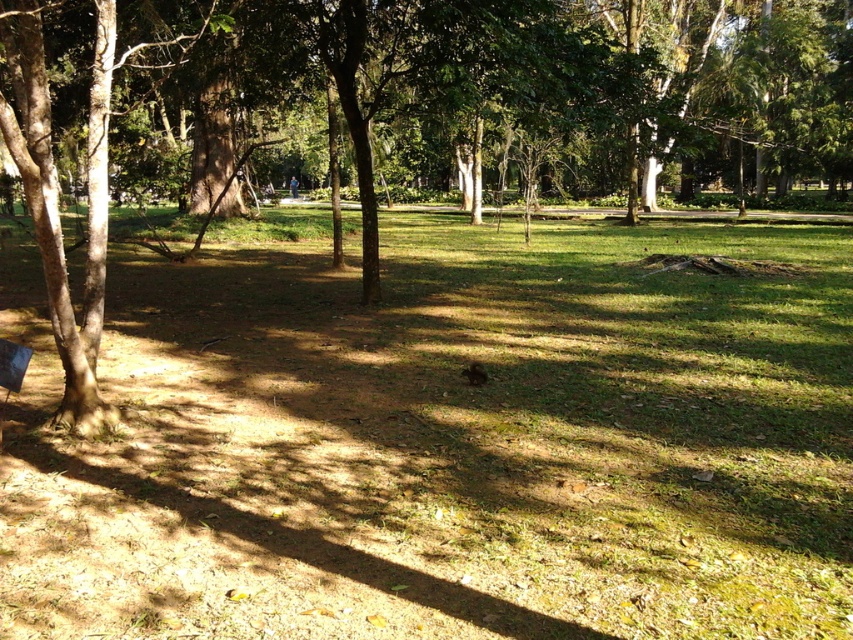
Where is `green grassy at center`? The height and width of the screenshot is (640, 853). green grassy at center is located at coordinates (445, 444).

Is green grassy at center shorter than brown textured tree at center?

Indeed, green grassy at center has a lesser height compared to brown textured tree at center.

You are a GUI agent. You are given a task and a screenshot of the screen. Output one action in this format:
    pyautogui.click(x=<x>, y=<y>)
    Task: Click on the green grassy at center
    The image size is (853, 640).
    Given the screenshot: What is the action you would take?
    pyautogui.click(x=445, y=444)

Does brown textured tree at center have a greater height compared to wooden park bench at lower left?

Correct, brown textured tree at center is much taller as wooden park bench at lower left.

What do you see at coordinates (428, 113) in the screenshot? This screenshot has width=853, height=640. I see `brown textured tree at center` at bounding box center [428, 113].

The height and width of the screenshot is (640, 853). What do you see at coordinates (428, 113) in the screenshot? I see `brown textured tree at center` at bounding box center [428, 113].

I want to click on brown textured tree at center, so click(428, 113).

Between point (265, 305) and point (3, 348), which one is positioned behind?

Point (265, 305)

The width and height of the screenshot is (853, 640). What are the coordinates of `green grassy at center` in the screenshot? It's located at (445, 444).

Locate an element on the screen. The height and width of the screenshot is (640, 853). green grassy at center is located at coordinates (445, 444).